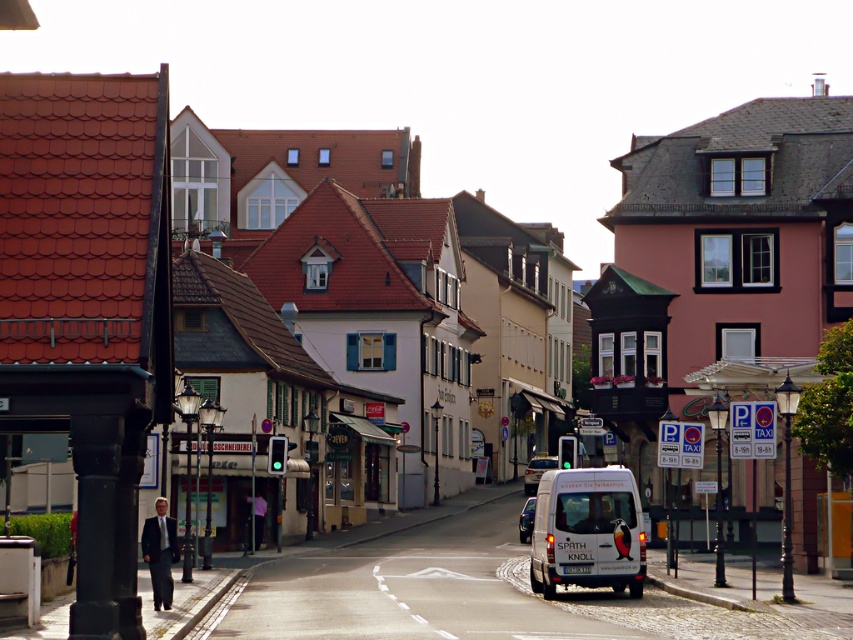
Question: Can you confirm if white matte van at center is positioned above metallic blue van at center?

Choices:
 (A) no
 (B) yes

Answer: (B)

Question: Which of the following is the farthest from the observer?

Choices:
 (A) (532, 472)
 (B) (592, 564)

Answer: (A)

Question: Which point is farther to the camera?

Choices:
 (A) white matte van at center
 (B) metallic blue van at center

Answer: (B)

Question: Can you confirm if white matte van at center is wider than metallic blue van at center?

Choices:
 (A) no
 (B) yes

Answer: (A)

Question: Based on their relative distances, which object is farther from the metallic silver van at center?

Choices:
 (A) white matte van at center
 (B) metallic blue van at center

Answer: (A)

Question: Does metallic silver van at center have a lesser width compared to metallic blue van at center?

Choices:
 (A) yes
 (B) no

Answer: (B)